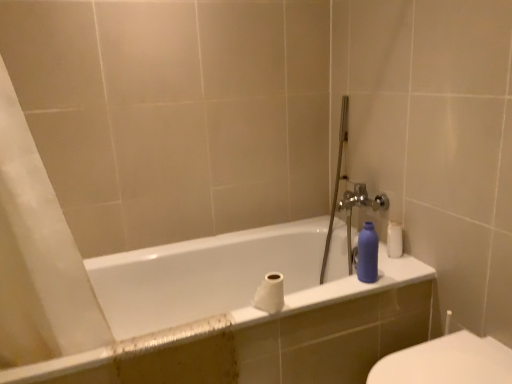
This screenshot has width=512, height=384. What do you see at coordinates (245, 312) in the screenshot?
I see `white glossy bathtub at center` at bounding box center [245, 312].

This screenshot has width=512, height=384. What do you see at coordinates (447, 362) in the screenshot?
I see `white glossy toilet at lower right` at bounding box center [447, 362].

Where is `white glossy bathtub at center`? The image size is (512, 384). white glossy bathtub at center is located at coordinates (245, 312).

Does matte plastic bottle at right appear on the right side of white glossy toilet at lower right?

In fact, matte plastic bottle at right is to the left of white glossy toilet at lower right.

Which of these two, matte plastic bottle at right or white glossy toilet at lower right, is bigger?

With larger size is white glossy toilet at lower right.

Which of these two, matte plastic bottle at right or white glossy toilet at lower right, stands shorter?

matte plastic bottle at right is shorter.

From the picture: Does matte plastic bottle at right come behind white glossy toilet at lower right?

Yes, matte plastic bottle at right is behind white glossy toilet at lower right.

The width and height of the screenshot is (512, 384). In order to click on bathtub in front of the matte plastic bottle at right in this screenshot , I will do `click(245, 312)`.

In the scene shown: From a real-world perspective, is matte plastic bottle at right positioned above or below white glossy bathtub at center?

matte plastic bottle at right is above white glossy bathtub at center.

Relative to white glossy bathtub at center, is matte plastic bottle at right in front or behind?

Visually, matte plastic bottle at right is located behind white glossy bathtub at center.

Is matte plastic bottle at right to the left or to the right of white glossy bathtub at center in the image?

Based on their positions, matte plastic bottle at right is located to the right of white glossy bathtub at center.

Is point (449, 347) farther from viewer compared to point (197, 277)?

No, it is in front of (197, 277).

In the scene shown: From a real-world perspective, is white glossy toilet at lower right positioned above or below white glossy bathtub at center?

In terms of real-world spatial position, white glossy toilet at lower right is above white glossy bathtub at center.

Could you tell me if white glossy toilet at lower right is facing white glossy bathtub at center?

No, white glossy toilet at lower right is not aimed at white glossy bathtub at center.

From the image's perspective, is matte plastic bottle at right under white matte toilet paper at center?

Incorrect, from the image's perspective, matte plastic bottle at right is higher than white matte toilet paper at center.

Is matte plastic bottle at right not within white matte toilet paper at center?

Absolutely, matte plastic bottle at right is external to white matte toilet paper at center.

Between matte plastic bottle at right and white matte toilet paper at center, which one has larger size?

white matte toilet paper at center is bigger.

Which is more to the left, matte plastic bottle at right or white matte toilet paper at center?

Positioned to the left is white matte toilet paper at center.

From a real-world perspective, between white matte toilet paper at center and white glossy bathtub at center, who is vertically higher?

In real-world perspective, white matte toilet paper at center is above.

From the image's perspective, which one is positioned higher, white matte toilet paper at center or white glossy bathtub at center?

white matte toilet paper at center, from the image's perspective.

Is white matte toilet paper at center spatially inside white glossy bathtub at center, or outside of it?

white matte toilet paper at center lies outside white glossy bathtub at center.

Is white glossy bathtub at center to the left or to the right of white glossy toilet at lower right in the image?

From the image, it's evident that white glossy bathtub at center is to the left of white glossy toilet at lower right.

Is white glossy bathtub at center completely or partially outside of white glossy toilet at lower right?

Indeed, white glossy bathtub at center is completely outside white glossy toilet at lower right.

From a real-world perspective, which is physically above, white glossy bathtub at center or white matte toilet paper at center?

In real-world perspective, white matte toilet paper at center is above.

Could you tell me if white glossy bathtub at center is turned towards white matte toilet paper at center?

No, white glossy bathtub at center does not turn towards white matte toilet paper at center.

Is white glossy bathtub at center positioned beyond the bounds of white matte toilet paper at center?

That's correct, white glossy bathtub at center is outside of white matte toilet paper at center.

How different are the orientations of white glossy bathtub at center and white matte toilet paper at center in degrees?

0.532 degrees separate the facing orientations of white glossy bathtub at center and white matte toilet paper at center.

Image resolution: width=512 pixels, height=384 pixels. Identify the location of toilet lying on the right of matte plastic bottle at right. (447, 362).

The width and height of the screenshot is (512, 384). Identify the location of toiletry above the white glossy bathtub at center (from the image's perspective). (367, 254).

Looking at the image, which one is located further to white glossy toilet at lower right, matte plastic bottle at right or white matte toilet paper at center?

white matte toilet paper at center is positioned further to the anchor white glossy toilet at lower right.

Consider the image. Considering their positions, is white matte toilet paper at center positioned closer to white glossy bathtub at center than matte plastic bottle at right?

white matte toilet paper at center.

Looking at the image, which one is located closer to matte plastic bottle at right, white glossy toilet at lower right or white glossy bathtub at center?

white glossy toilet at lower right is positioned closer to the anchor matte plastic bottle at right.

Considering their positions, is white matte toilet paper at center positioned closer to white glossy toilet at lower right than white glossy bathtub at center?

white matte toilet paper at center.

When comparing their distances from white matte toilet paper at center, does white glossy bathtub at center or white glossy toilet at lower right seem closer?

white glossy bathtub at center.

Considering their positions, is white glossy bathtub at center positioned further to white matte toilet paper at center than matte plastic bottle at right?

Based on the image, white glossy bathtub at center appears to be further to white matte toilet paper at center.

When comparing their distances from white glossy toilet at lower right, does white matte toilet paper at center or matte plastic bottle at right seem further?

Answer: The object further to white glossy toilet at lower right is white matte toilet paper at center.

Based on their spatial positions, is matte plastic bottle at right or white matte toilet paper at center further from white glossy bathtub at center?

Among the two, matte plastic bottle at right is located further to white glossy bathtub at center.

Find the location of `toilet paper located between white glossy toilet at lower right and matte plastic bottle at right in the depth direction`. toilet paper located between white glossy toilet at lower right and matte plastic bottle at right in the depth direction is located at coordinates (270, 294).

Where is `toiletry between white glossy bathtub at center and white glossy toilet at lower right in the horizontal direction`? toiletry between white glossy bathtub at center and white glossy toilet at lower right in the horizontal direction is located at coordinates (367, 254).

The height and width of the screenshot is (384, 512). Identify the location of toilet paper between white glossy bathtub at center and white glossy toilet at lower right from left to right. (270, 294).

Where is `toilet paper located between white glossy bathtub at center and matte plastic bottle at right in the left-right direction`? toilet paper located between white glossy bathtub at center and matte plastic bottle at right in the left-right direction is located at coordinates (270, 294).